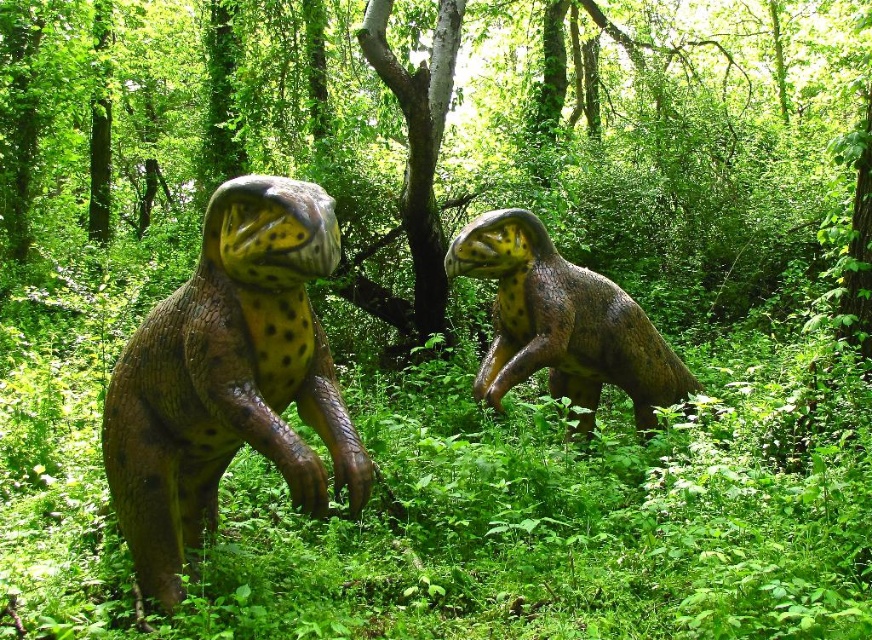
Is the position of brown textured dinosaur at left less distant than that of brown textured dinosaur at center?

Yes, it is.

Who is more forward, (222, 369) or (658, 365)?

Point (222, 369) is more forward.

Locate an element on the screen. brown textured dinosaur at left is located at coordinates (229, 378).